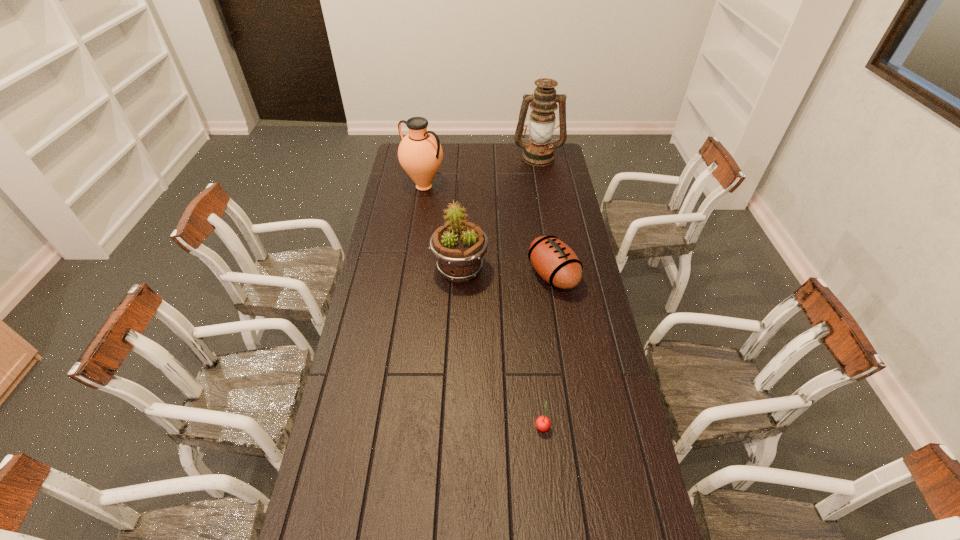
Locate which object is the second closest to the tallest object. Please provide its 2D coordinates. Your answer should be formatted as a tuple, i.e. [(x, y)], where the tuple contains the x and y coordinates of a point satisfying the conditions above.

[(554, 261)]

Locate an element on the screen. vacant space that satisfies the following two spatial constraints: 1. on the back side of the tallest object; 2. on the left side of the football (American) is located at coordinates (534, 157).

The height and width of the screenshot is (540, 960). What are the coordinates of `vacant region that satisfies the following two spatial constraints: 1. on the front side of the cherry; 2. on the right side of the pitcher` in the screenshot? It's located at (388, 426).

The image size is (960, 540). I want to click on free space that satisfies the following two spatial constraints: 1. on the front side of the flowerpot; 2. on the left side of the pitcher, so click(x=411, y=270).

Image resolution: width=960 pixels, height=540 pixels. Find the location of `vacant space that satisfies the following two spatial constraints: 1. on the back side of the tallest object; 2. on the right side of the football (American)`. vacant space that satisfies the following two spatial constraints: 1. on the back side of the tallest object; 2. on the right side of the football (American) is located at coordinates (534, 157).

This screenshot has height=540, width=960. Find the location of `vacant region that satisfies the following two spatial constraints: 1. on the front side of the football (American); 2. on the left side of the flowerpot`. vacant region that satisfies the following two spatial constraints: 1. on the front side of the football (American); 2. on the left side of the flowerpot is located at coordinates (460, 275).